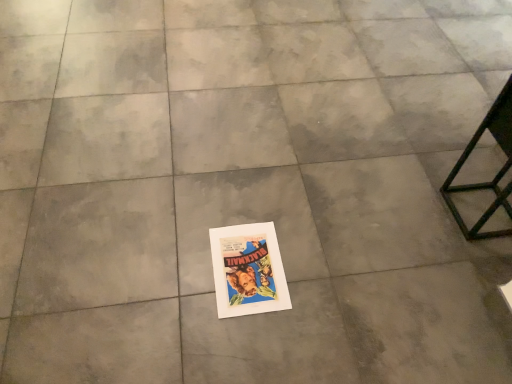
Locate an element on the screen. The image size is (512, 384). vacant space in vibrant paper poster at center (from a real-world perspective) is located at coordinates (247, 268).